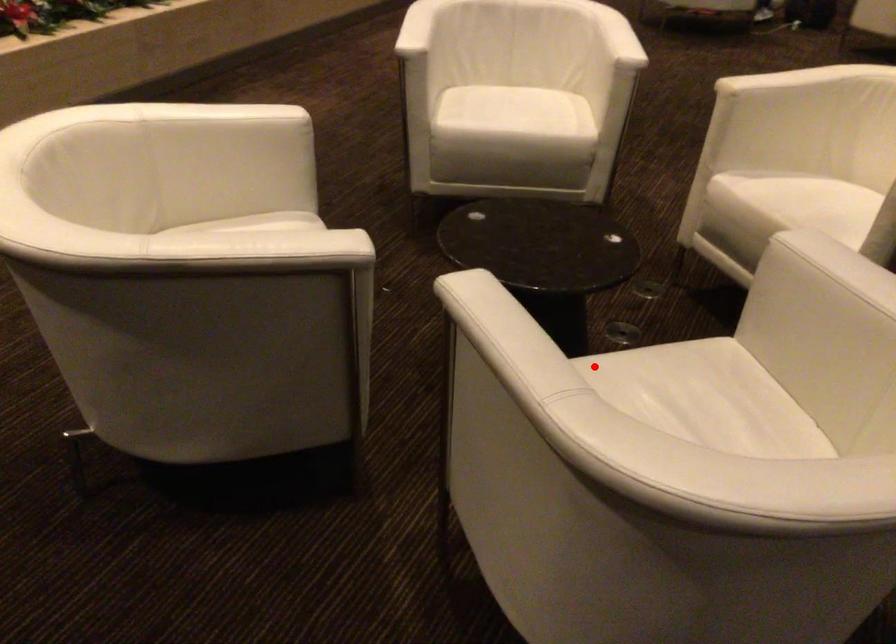
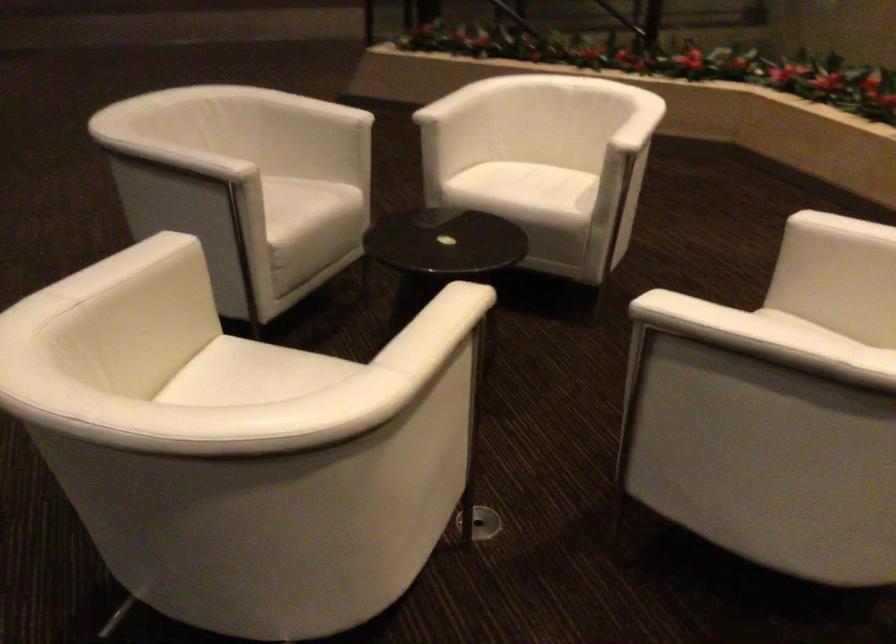
Question: I am providing you with two images of the same scene from different viewpoints. Given a red point in image1, look at the same physical point in image2. Is it:

Choices:
 (A) Closer to the viewpoint
 (B) Farther from the viewpoint

Answer: (B)